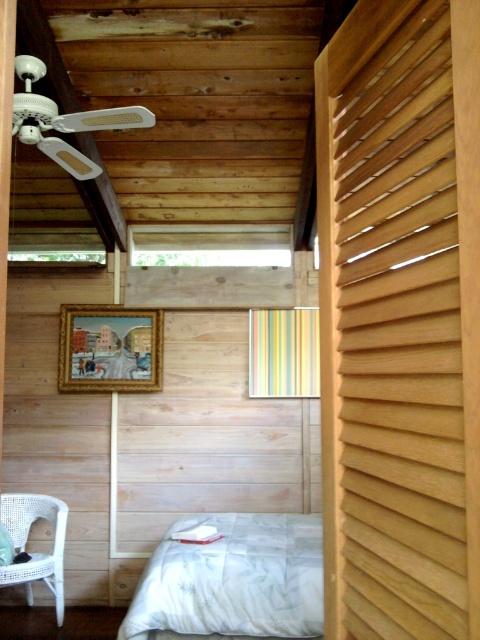
Question: Which object appears closest to the camera in this image?

Choices:
 (A) light brown wooden slats at right
 (B) white soft bed at lower center

Answer: (A)

Question: Is light brown wooden slats at right behind white soft bed at lower center?

Choices:
 (A) no
 (B) yes

Answer: (A)

Question: Is light brown wooden slats at right to the left of white wicker chair at lower left from the viewer's perspective?

Choices:
 (A) no
 (B) yes

Answer: (A)

Question: Does light brown wooden slats at right lie behind white soft bed at lower center?

Choices:
 (A) yes
 (B) no

Answer: (B)

Question: Among these points, which one is nearest to the camera?

Choices:
 (A) (0, 525)
 (B) (455, 360)
 (C) (14, 541)

Answer: (B)

Question: Which point appears closest to the camera in this image?

Choices:
 (A) (15, 513)
 (B) (2, 541)

Answer: (B)